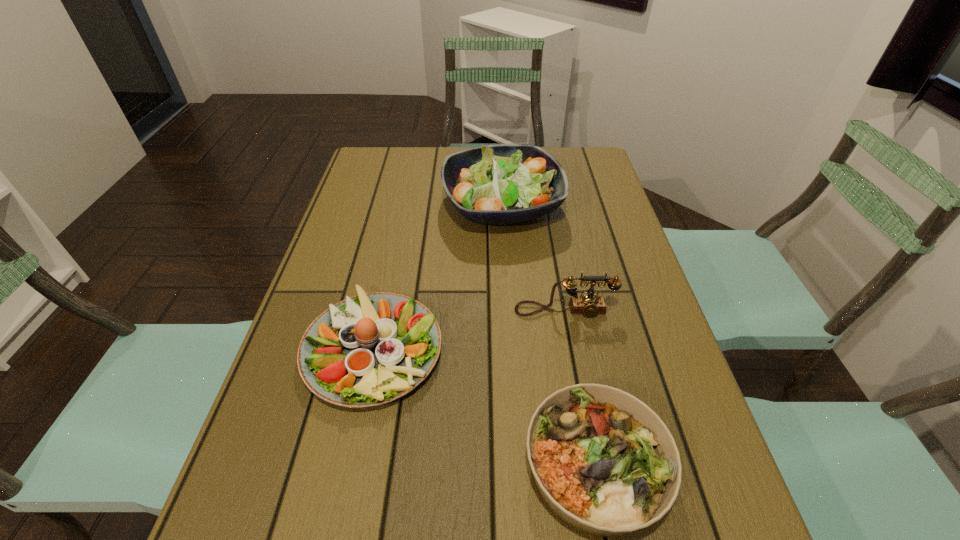
Where is `the tallest object`? Image resolution: width=960 pixels, height=540 pixels. the tallest object is located at coordinates (498, 184).

Image resolution: width=960 pixels, height=540 pixels. In order to click on the tallest salad plate in this screenshot , I will do `click(498, 184)`.

Locate an element on the screen. The height and width of the screenshot is (540, 960). telephone is located at coordinates (588, 304).

Where is `the second tallest salad plate`? the second tallest salad plate is located at coordinates (368, 350).

The image size is (960, 540). What are the coordinates of `free space located on the left of the farthest salad plate` in the screenshot? It's located at (364, 206).

The image size is (960, 540). What are the coordinates of `blank area located on the front-facing side of the telephone` in the screenshot? It's located at (569, 337).

The width and height of the screenshot is (960, 540). I want to click on blank space located on the back of the second shortest salad plate, so click(399, 227).

At what (x,y) coordinates should I click in order to perform the action: click on object present at the far edge. Please return your answer as a coordinate pair (x, y). Looking at the image, I should click on (498, 184).

This screenshot has height=540, width=960. I want to click on object that is at the left edge, so click(368, 350).

The image size is (960, 540). In order to click on salad plate present at the right edge in this screenshot , I will do `click(498, 184)`.